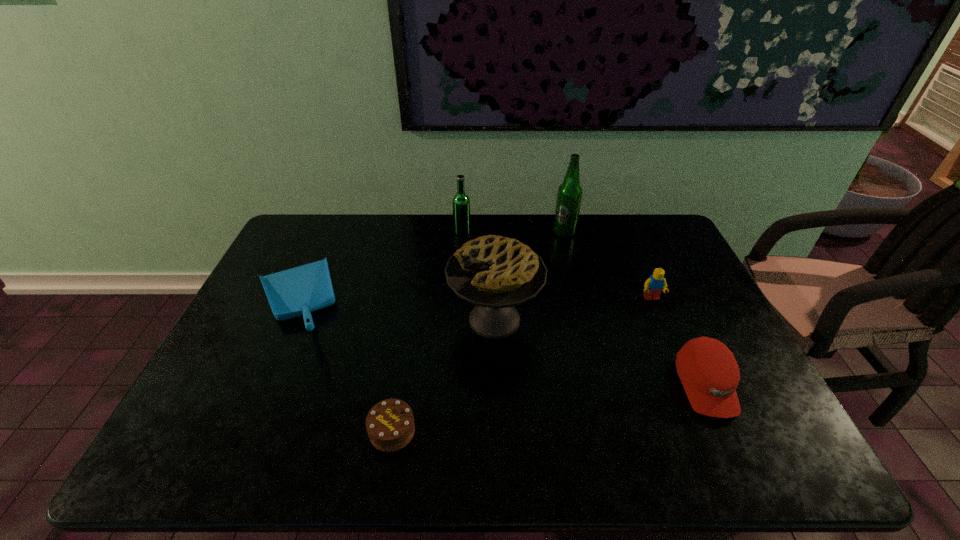
Identify the location of the taller beer bottle. (569, 195).

Where is `the right beer bottle`? Image resolution: width=960 pixels, height=540 pixels. the right beer bottle is located at coordinates (569, 195).

Identify the location of pie. (495, 273).

Locate an element on the screen. the shorter beer bottle is located at coordinates (461, 203).

The width and height of the screenshot is (960, 540). In order to click on dustpan in this screenshot , I will do `click(298, 291)`.

At what (x,y) coordinates should I click in order to perform the action: click on Lego. Please return your answer as a coordinate pair (x, y). The width and height of the screenshot is (960, 540). Looking at the image, I should click on (653, 286).

Image resolution: width=960 pixels, height=540 pixels. I want to click on cap, so click(708, 370).

Identify the location of chocolate cake. (390, 426).

Where is `the shortest object`? The image size is (960, 540). the shortest object is located at coordinates (390, 426).

This screenshot has height=540, width=960. I want to click on vacant space located on the label of the third object from right to left, so click(584, 310).